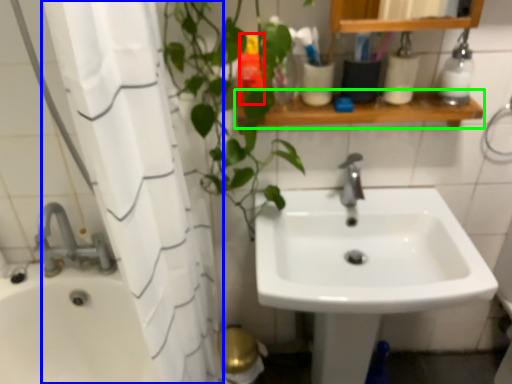
Question: Which is farther away from toiletry (highlighted by a red box)? shower curtain (highlighted by a blue box) or balustrade (highlighted by a green box)?

Choices:
 (A) shower curtain
 (B) balustrade

Answer: (A)